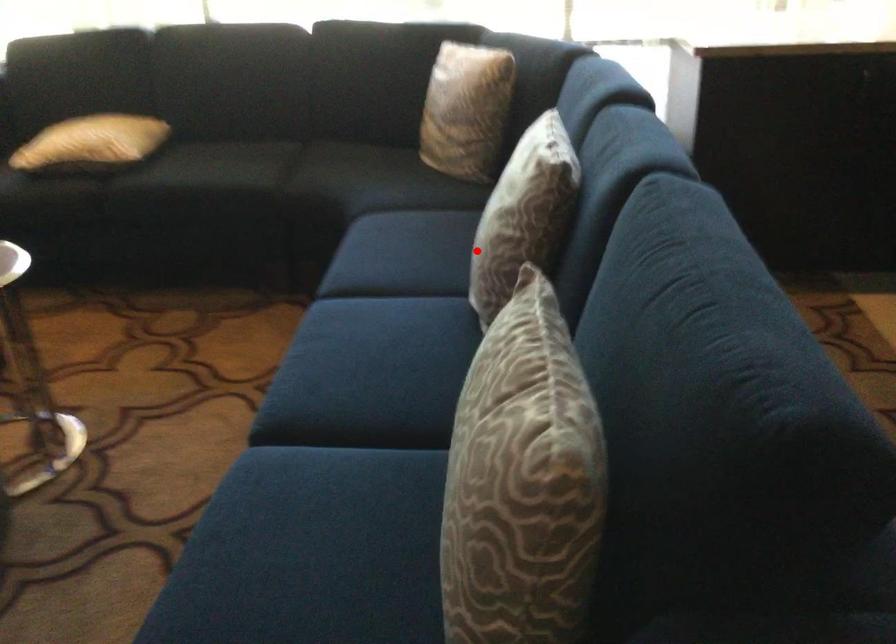
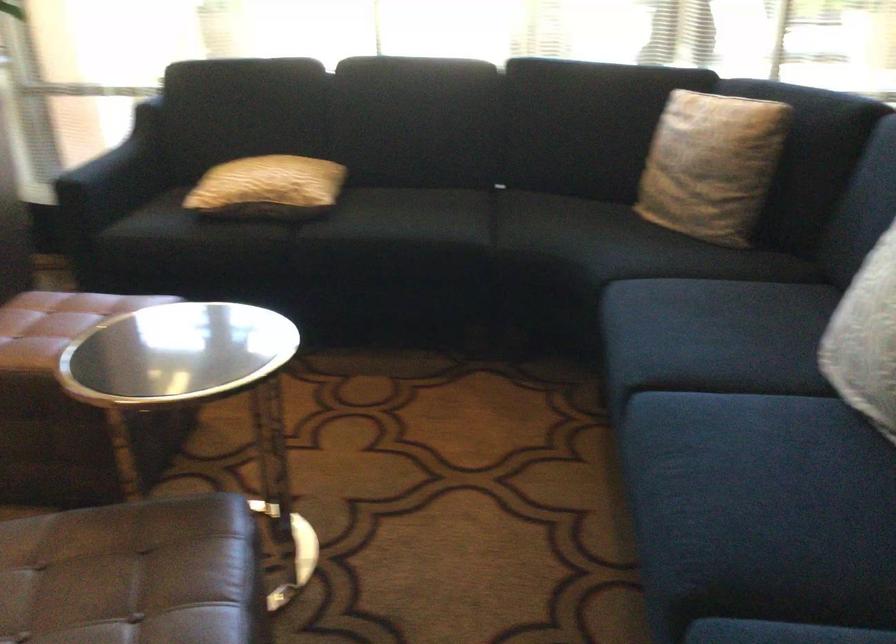
The point at the highlighted location is marked in the first image. Where is the corresponding point in the second image?

(866, 339)